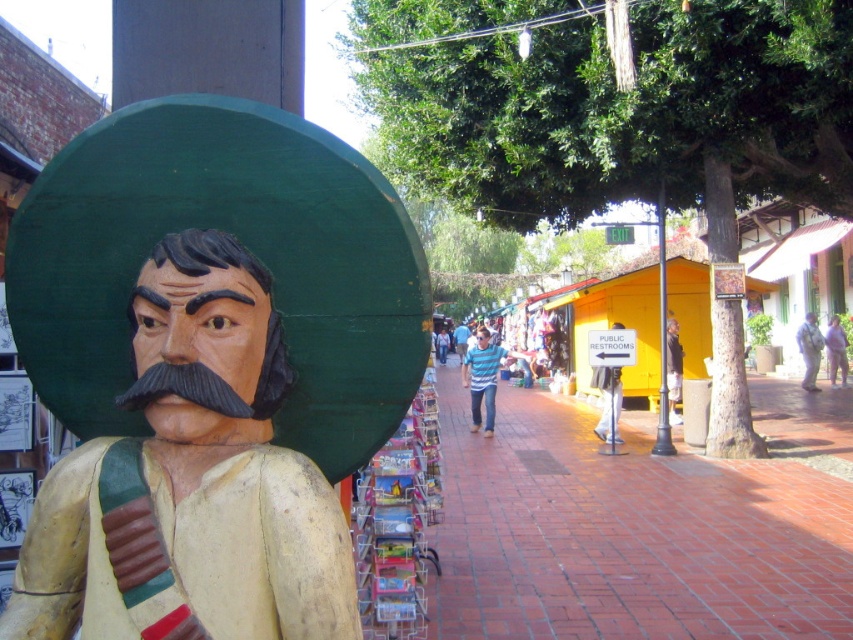
You are a street performer standing on the brick pavement at center and want to place a large, heavy box on the light pink fabric at lower right. Considering the height difference between the two, will the box be higher or lower than the surrounding brick pavement?

The brick pavement at center has a lesser height compared to light pink fabric at lower right, so placing the box on the light pink fabric at lower right will make it higher than the surrounding brick pavement.

You are a street performer who needs to set up a 1.5 meter wide stage. You see the brick pavement at center and the light pink fabric at lower right. Which location can accommodate your stage?

The brick pavement at center can accommodate the 1.5 meter wide stage since its width is larger than the light pink fabric at lower right.

You are a tourist walking along the brick pavement at center and want to take a photo of the wooden statue at left. In which direction should you move to get a better view of the statue?

The wooden statue at left is positioned on the left side of brick pavement at center, so you should move to the left side of the brick pavement at center to get a better view of the wooden statue at left.